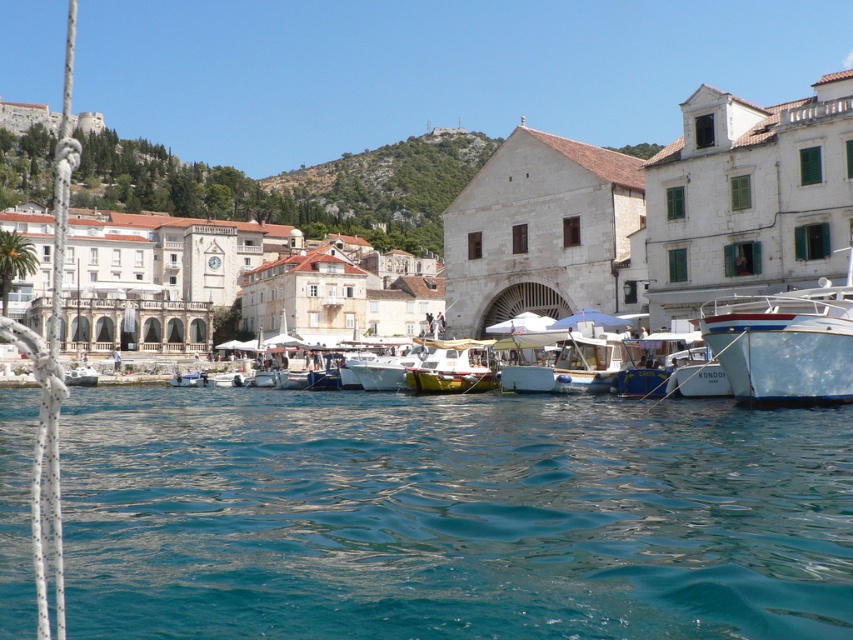
You are standing on the shore of the harbor and want to visit a point located at coordinates point (285, 268). If your maximum comfortable walking distance is 120 meters, can you reach this point without feeling strained?

The distance of point (285, 268) from the viewer is 135.82 meters, which exceeds your maximum comfortable walking distance of 120 meters. Therefore, you might feel strained if you try to walk to that point.

Based on the photo, you are a tourist standing on the dock and want to take a photo of both the white stone building at center and the white glossy boat at right. Which object should you position closer to the camera to ensure both are in focus?

The white stone building at center is much taller than the white glossy boat at right, so you should position the white stone building at center closer to the camera to ensure both are in focus.